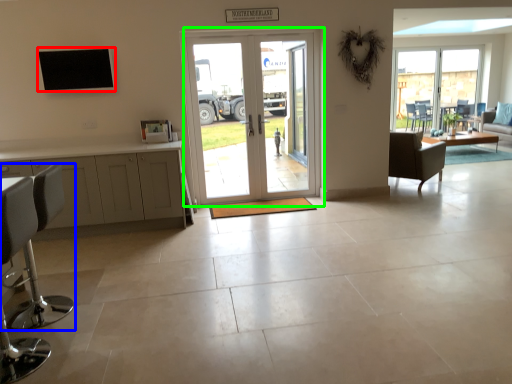
Question: Based on their relative distances, which object is farther from window (highlighted by a red box)? Choose from chair (highlighted by a blue box) and door (highlighted by a green box).

Choices:
 (A) chair
 (B) door

Answer: (A)